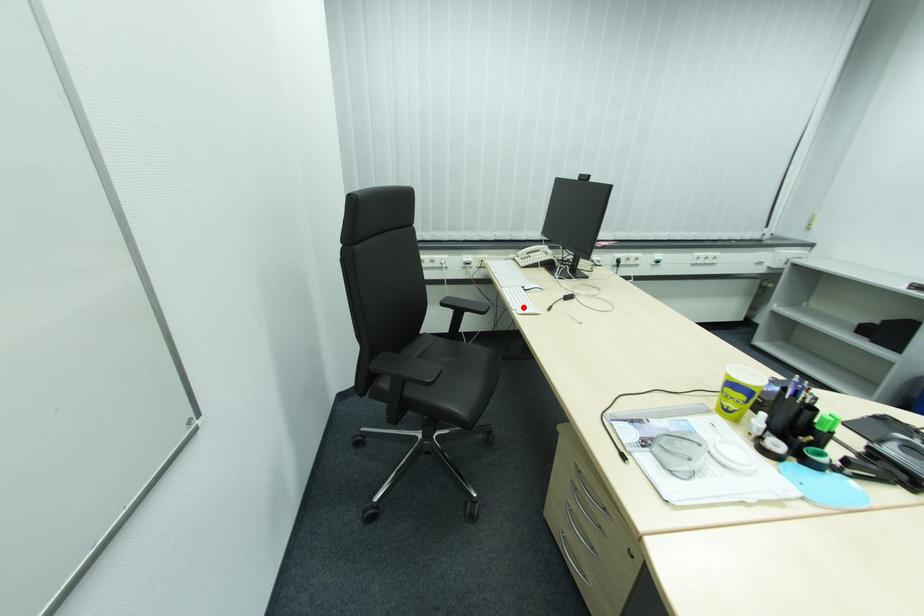
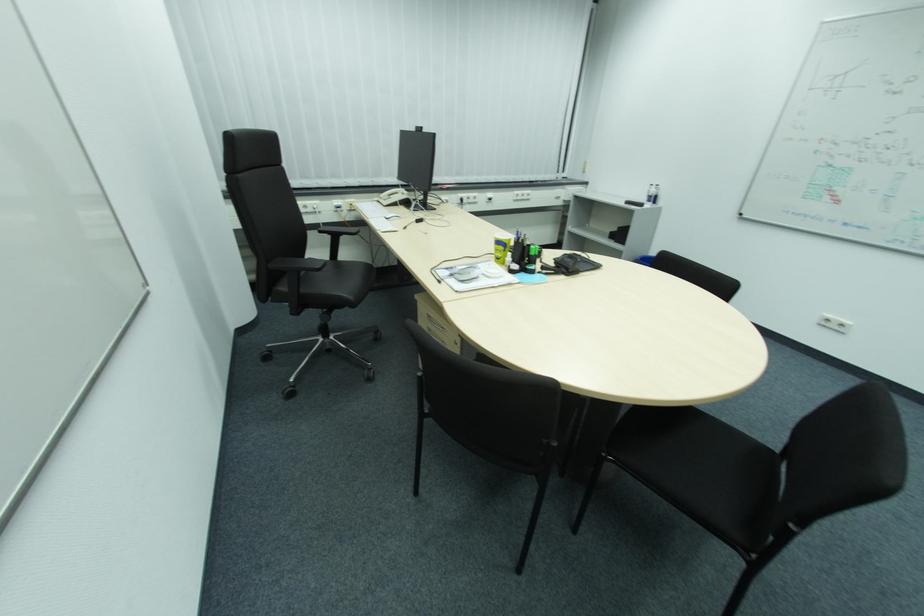
The point at the highlighted location is marked in the first image. Where is the corresponding point in the second image?

(386, 229)